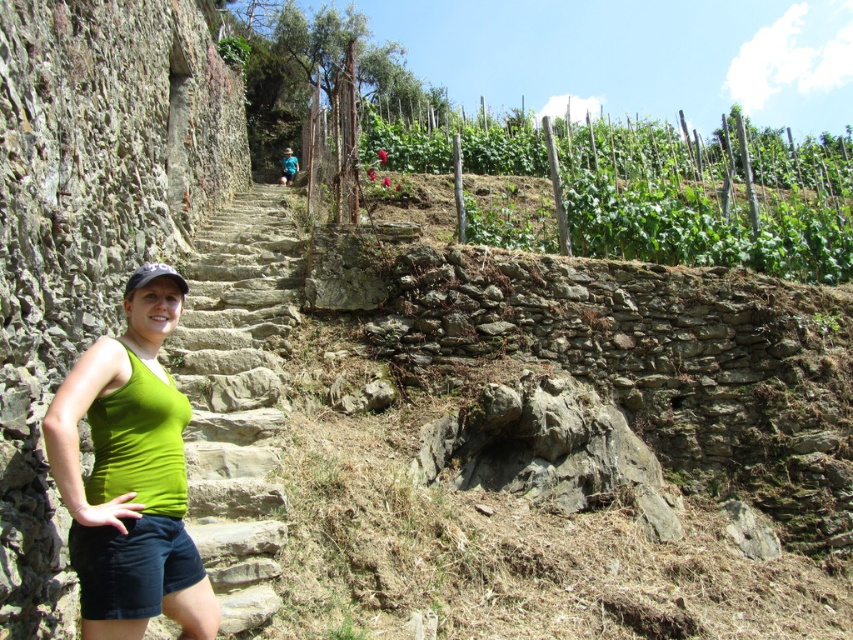
Question: Among these objects, which one is farthest from the camera?

Choices:
 (A) stone stairs at center
 (B) green fabric tank top at center

Answer: (A)

Question: Which object is farther from the camera taking this photo?

Choices:
 (A) green fabric tank top at center
 (B) dark blue corduroy shorts at lower left

Answer: (B)

Question: Is green fabric tank top at center positioned at the back of dark blue corduroy shorts at lower left?

Choices:
 (A) yes
 (B) no

Answer: (B)

Question: Which object is farther from the camera taking this photo?

Choices:
 (A) green fabric tank top at center
 (B) dark blue corduroy shorts at lower left

Answer: (B)

Question: In this image, where is stone stairs at center located relative to green fabric tank top at center?

Choices:
 (A) below
 (B) above

Answer: (B)

Question: Does green fabric tank top at center have a lesser width compared to dark blue corduroy shorts at lower left?

Choices:
 (A) no
 (B) yes

Answer: (A)